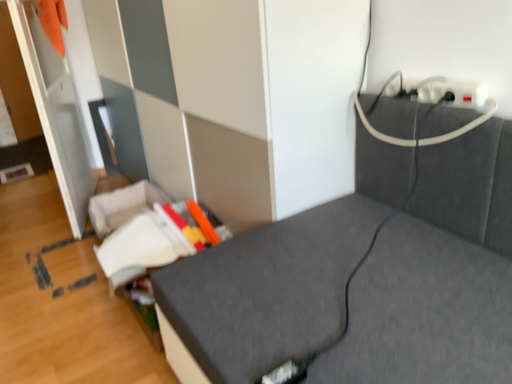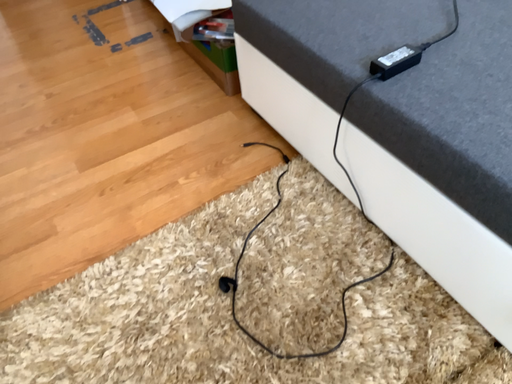
Question: How did the camera likely rotate when shooting the video?

Choices:
 (A) rotated upward
 (B) rotated downward

Answer: (B)